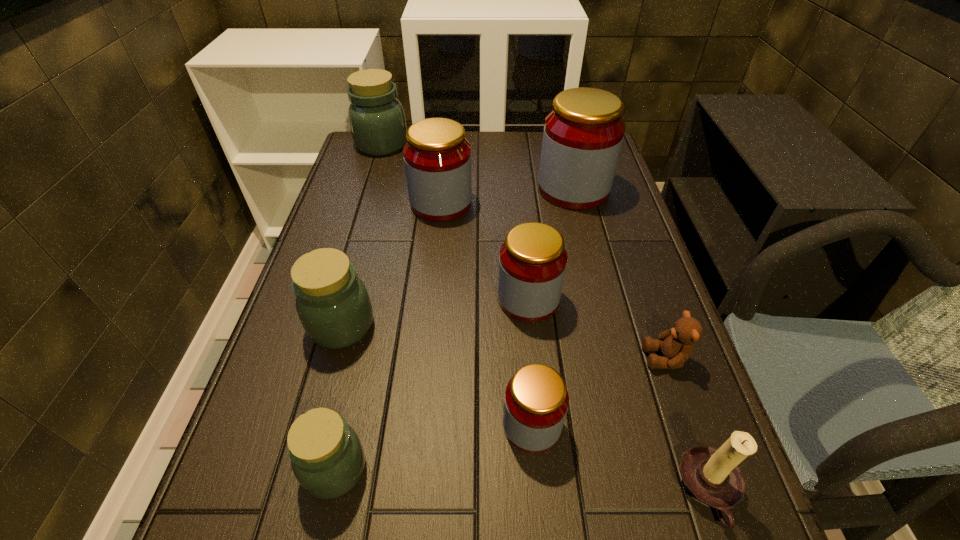
This screenshot has height=540, width=960. I want to click on the tallest object, so click(583, 134).

You are a GUI agent. You are given a task and a screenshot of the screen. Output one action in this format:
    pyautogui.click(x=<x>, y=<y>)
    Task: Click on the tallest jar
    
    Given the screenshot: What is the action you would take?
    pyautogui.click(x=583, y=134)

Find the location of a particular element. The width and height of the screenshot is (960, 540). the farthest green jar is located at coordinates (377, 122).

At what (x,y) coordinates should I click in order to perform the action: click on the biggest green jar. Please return your answer as a coordinate pair (x, y). This screenshot has height=540, width=960. Looking at the image, I should click on (377, 122).

Locate an element on the screen. the leftmost red jar is located at coordinates (x=437, y=157).

Locate an element on the screen. The width and height of the screenshot is (960, 540). the second nearest green jar is located at coordinates (333, 305).

Where is `the second nearest red jar`? The height and width of the screenshot is (540, 960). the second nearest red jar is located at coordinates (532, 262).

This screenshot has height=540, width=960. Find the location of `candle holder`. candle holder is located at coordinates (711, 476).

This screenshot has width=960, height=540. Identify the location of the smallest red jar. (536, 402).

Find the location of a particular element. This screenshot has height=540, width=960. the smallest green jar is located at coordinates (327, 457).